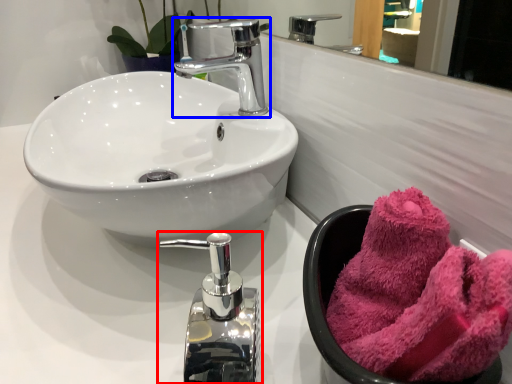
Question: Which object is closer to the camera taking this photo, tap (highlighted by a red box) or tap (highlighted by a blue box)?

Choices:
 (A) tap
 (B) tap

Answer: (A)